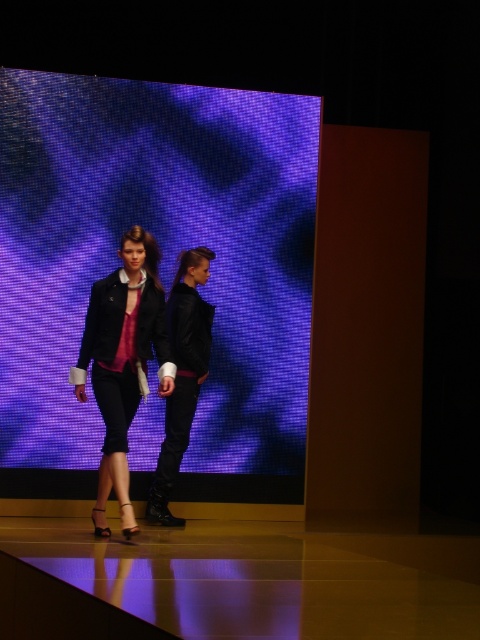
In the scene shown: Which is above, shiny brown platform at lower center or matte black jacket at center?

matte black jacket at center is above.

Is point (215, 612) closer to camera compared to point (96, 344)?

Yes, it is in front of point (96, 344).

The width and height of the screenshot is (480, 640). In order to click on shiny brown platform at lower center in this screenshot , I will do `click(265, 579)`.

Does point (277, 378) come behind point (178, 346)?

Yes, it is behind point (178, 346).

Between matte purple screen at center and leather jacket at center, which one is positioned lower?

leather jacket at center is lower down.

Is point (245, 161) positioned behind point (189, 344)?

Yes, point (245, 161) is behind point (189, 344).

This screenshot has height=640, width=480. Identify the location of matte purple screen at center. (159, 268).

Between shiny brown platform at lower center and leather jacket at center, which one appears on the right side from the viewer's perspective?

From the viewer's perspective, shiny brown platform at lower center appears more on the right side.

Is shiny brown platform at lower center further to the viewer compared to leather jacket at center?

No, it is not.

Is point (186, 627) farther from camera compared to point (190, 372)?

No, (186, 627) is closer to viewer.

Find the location of `shiny brown platform at lower center`. shiny brown platform at lower center is located at coordinates (265, 579).